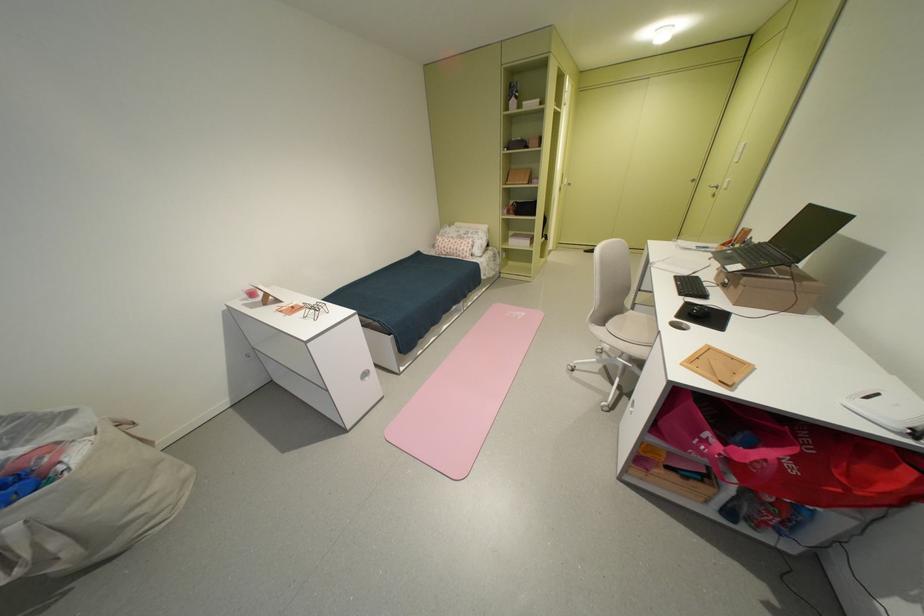
Image resolution: width=924 pixels, height=616 pixels. Describe the element at coordinates (776, 290) in the screenshot. I see `a cardboard box` at that location.